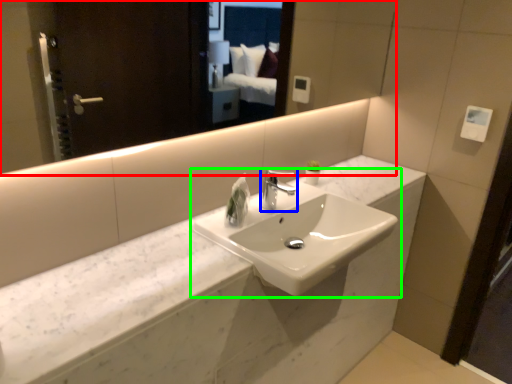
Question: Which is nearer to the mirror (highlighted by a red box)? tap (highlighted by a blue box) or sink (highlighted by a green box).

Choices:
 (A) tap
 (B) sink

Answer: (A)